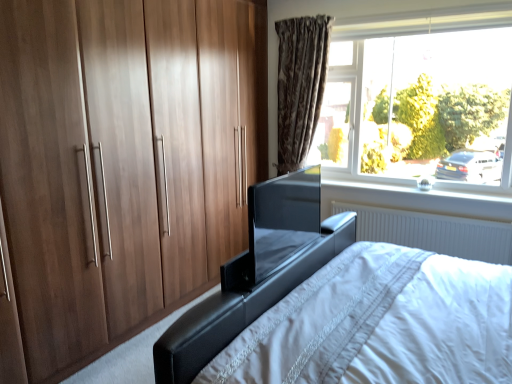
Question: Is transparent glass tv at center bigger or smaller than brown textured curtain at upper center?

Choices:
 (A) big
 (B) small

Answer: (B)

Question: Considering their positions, is transparent glass tv at center located in front of or behind brown textured curtain at upper center?

Choices:
 (A) behind
 (B) front

Answer: (B)

Question: Which is farther from the transparent glass tv at center?

Choices:
 (A) transparent glass window at upper right
 (B) black leather bed at center
 (C) wooden wardrobe at left
 (D) black leather bed frame at lower center
 (E) white glossy window sill at upper right

Answer: (A)

Question: Considering the real-world distances, which object is closest to the brown textured curtain at upper center?

Choices:
 (A) white glossy window sill at upper right
 (B) white plastic radiator at lower right
 (C) transparent glass tv at center
 (D) transparent glass window at upper right
 (E) black leather bed frame at lower center

Answer: (D)